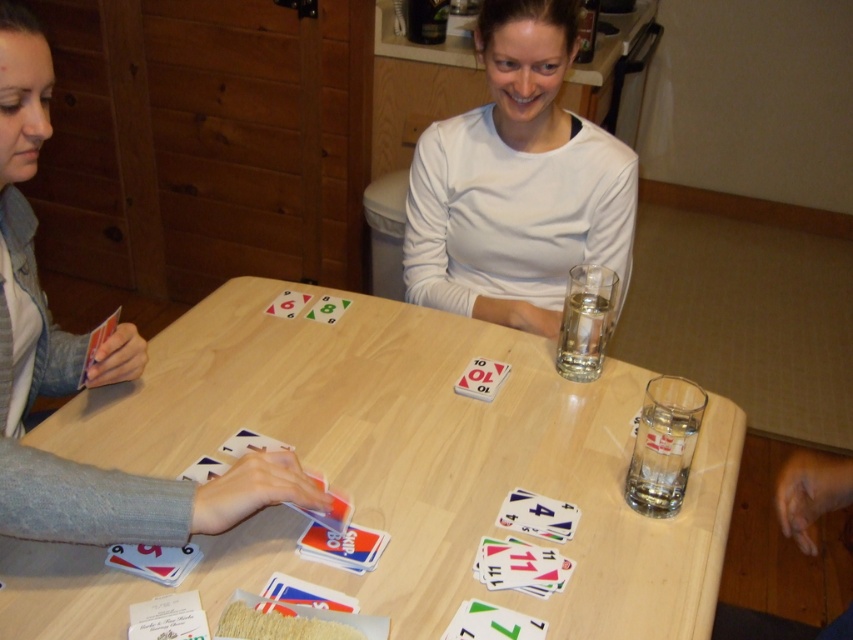
Question: Which point is closer to the camera?

Choices:
 (A) white matte card at center
 (B) matte plastic card at center

Answer: (A)

Question: Which is farther from the smooth plastic cards at lower left?

Choices:
 (A) white matte shirt at upper center
 (B) white matte card at center
 (C) matte plastic card at center
 (D) green matte card at center

Answer: (A)

Question: Which object appears farthest from the camera in this image?

Choices:
 (A) white matte shirt at upper center
 (B) white matte card at center

Answer: (A)

Question: Can you confirm if white matte card at center is wider than green matte card at center?

Choices:
 (A) yes
 (B) no

Answer: (A)

Question: Does white matte shirt at upper center appear on the left side of smooth plastic cards at lower left?

Choices:
 (A) no
 (B) yes

Answer: (A)

Question: Can you confirm if white matte shirt at upper center is bigger than smooth plastic cards at lower left?

Choices:
 (A) yes
 (B) no

Answer: (B)